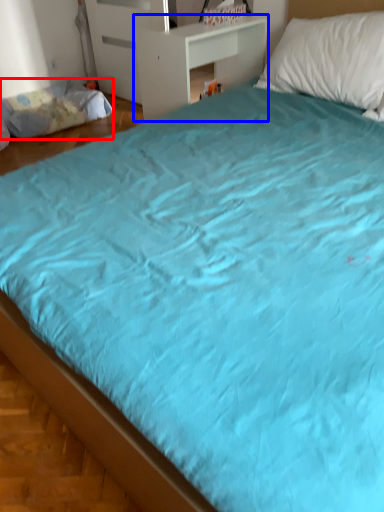
Question: Which of the following is the farthest to the observer, mattress (highlighted by a red box) or table (highlighted by a blue box)?

Choices:
 (A) mattress
 (B) table

Answer: (A)